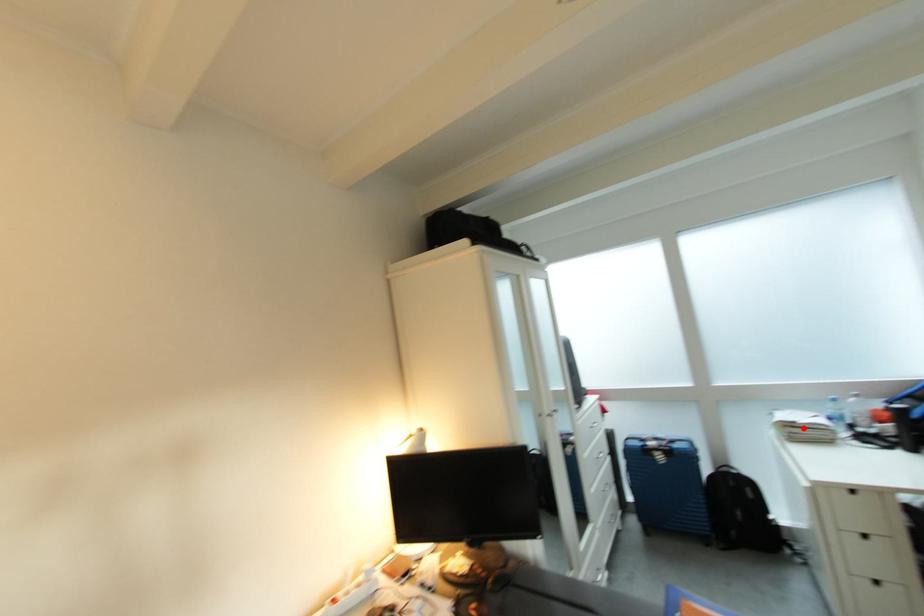
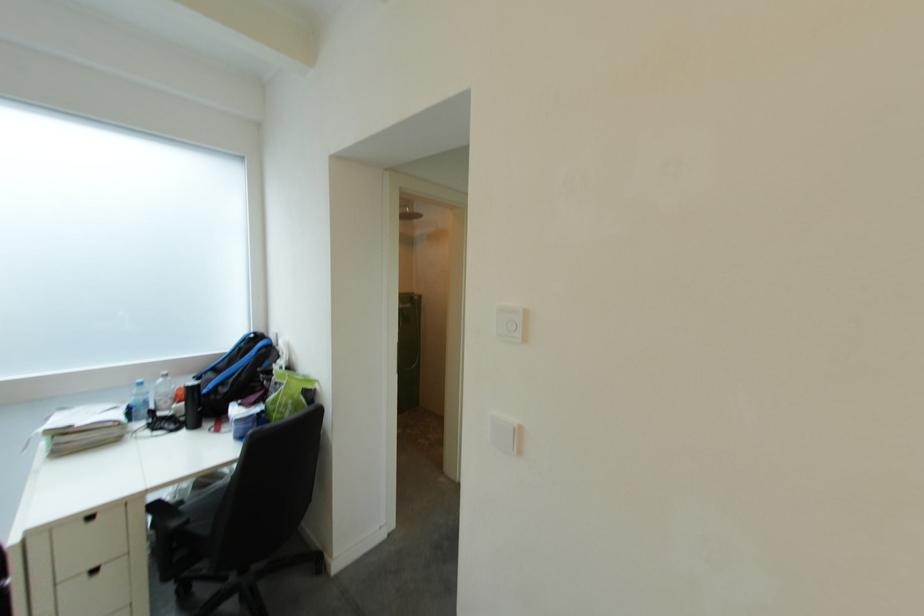
In the second image, find the point that corresponds to the highlighted location in the first image.

(73, 436)